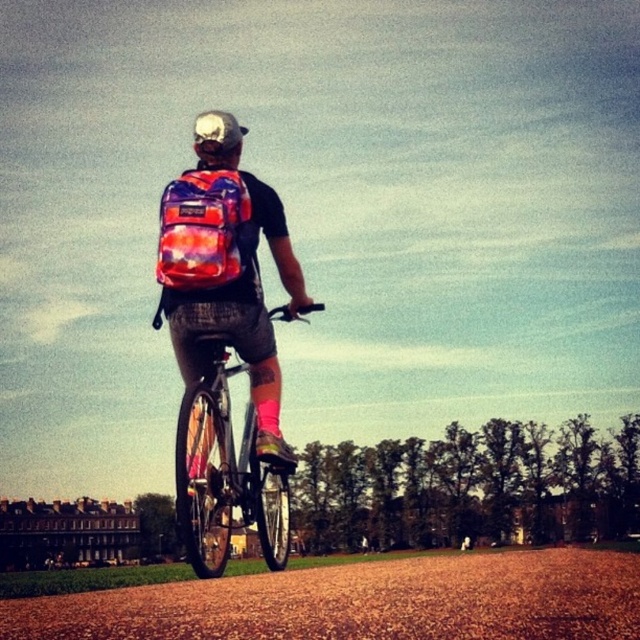
Which is more to the left, brown gravel path at center or shiny metallic bicycle at center?

shiny metallic bicycle at center

I want to click on brown gravel path at center, so click(x=362, y=602).

The width and height of the screenshot is (640, 640). In order to click on brown gravel path at center in this screenshot , I will do `click(362, 602)`.

The width and height of the screenshot is (640, 640). In order to click on brown gravel path at center in this screenshot , I will do `click(362, 602)`.

Can you confirm if shiny metallic bicycle at center is taller than shiny multicolored backpack at center?

Yes.

Does point (276, 563) lie in front of point (172, 248)?

No.

Locate an element on the screen. shiny metallic bicycle at center is located at coordinates (225, 472).

Between multicolored fabric backpack at center and white matte bicycle helmet at upper center, which one appears on the right side from the viewer's perspective?

From the viewer's perspective, multicolored fabric backpack at center appears more on the right side.

Where is `multicolored fabric backpack at center`? The height and width of the screenshot is (640, 640). multicolored fabric backpack at center is located at coordinates (225, 268).

The image size is (640, 640). I want to click on multicolored fabric backpack at center, so click(225, 268).